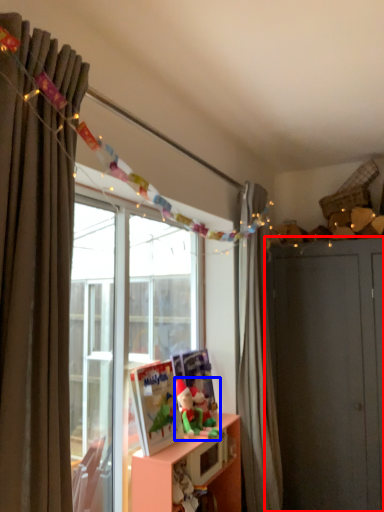
Question: Which object appears farthest to the camera in this image, dresser (highlighted by a red box) or toy (highlighted by a blue box)?

Choices:
 (A) dresser
 (B) toy

Answer: (A)